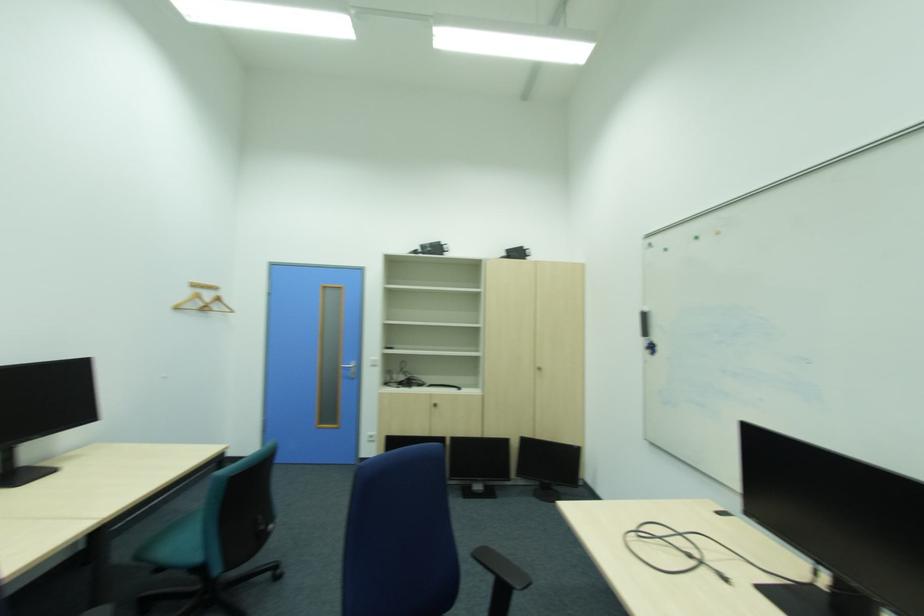
Image resolution: width=924 pixels, height=616 pixels. Identify the location of black chair armrest. pos(502,567).